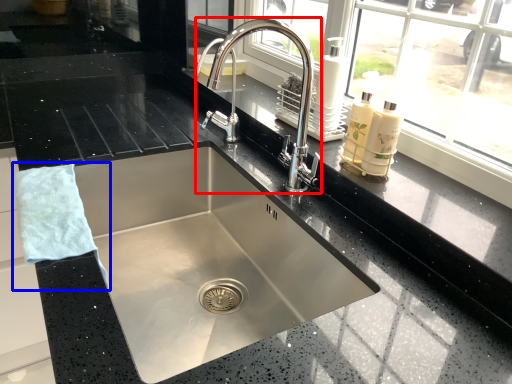
Question: Which object is further to the camera taking this photo, tap (highlighted by a red box) or hand towel (highlighted by a blue box)?

Choices:
 (A) tap
 (B) hand towel

Answer: (A)